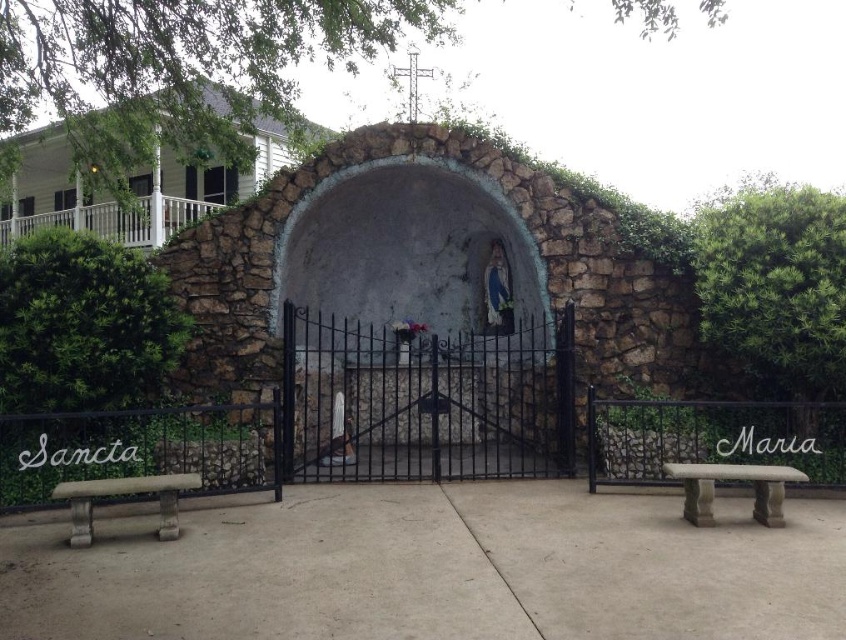
Does stone wall at upper left have a smaller size compared to stone bench at lower left?

Correct, stone wall at upper left occupies less space than stone bench at lower left.

Which is behind, point (53, 218) or point (195, 477)?

The point (53, 218) is more distant.

Between point (168, 205) and point (179, 492), which one is positioned behind?

Positioned behind is point (168, 205).

At what (x,y) coordinates should I click in order to perform the action: click on stone wall at upper left. Please return your answer as a coordinate pair (x, y). The width and height of the screenshot is (846, 640). Looking at the image, I should click on (130, 188).

In the scene shown: Between stone wall at upper left and stone bench at lower right, which one appears on the left side from the viewer's perspective?

stone wall at upper left is more to the left.

Does stone wall at upper left have a larger size compared to stone bench at lower right?

Indeed, stone wall at upper left has a larger size compared to stone bench at lower right.

Where is `stone wall at upper left`? This screenshot has width=846, height=640. stone wall at upper left is located at coordinates (130, 188).

Who is shorter, stone bench at lower right or stone bench at lower left?

stone bench at lower left

Does stone bench at lower right have a lesser width compared to stone bench at lower left?

Yes.

The image size is (846, 640). Find the location of `stone bench at lower right`. stone bench at lower right is located at coordinates (732, 480).

You are a GUI agent. You are given a task and a screenshot of the screen. Output one action in this format:
    pyautogui.click(x=<x>, y=<y>)
    Task: Click on the stone bench at lower right
    
    Given the screenshot: What is the action you would take?
    pyautogui.click(x=732, y=480)